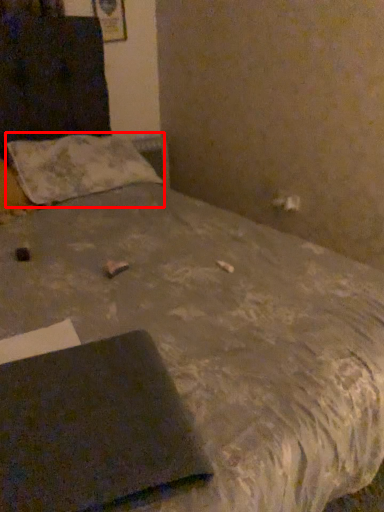
Question: From the image's perspective, considering the relative positions of pillow (annotated by the red box) and notebook in the image provided, where is pillow (annotated by the red box) located with respect to the staircase?

Choices:
 (A) above
 (B) below

Answer: (A)